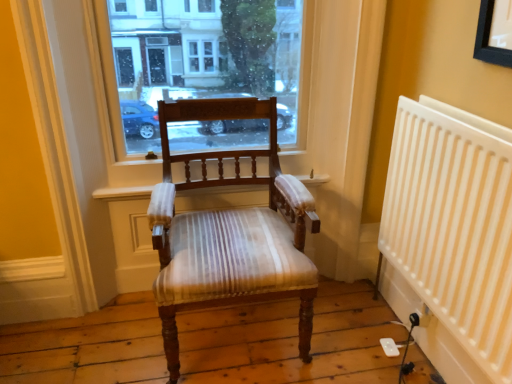
The height and width of the screenshot is (384, 512). What do you see at coordinates (230, 231) in the screenshot?
I see `wooden chair with striped upholstery at center` at bounding box center [230, 231].

Find the location of a particular element. This screenshot has height=384, width=512. transparent glass window at center is located at coordinates (201, 60).

Locate an element on the screen. The height and width of the screenshot is (384, 512). wooden chair with striped upholstery at center is located at coordinates (230, 231).

Can you confirm if wooden chair with striped upholstery at center is smaller than transparent glass window at center?

Incorrect, wooden chair with striped upholstery at center is not smaller in size than transparent glass window at center.

From a real-world perspective, is wooden chair with striped upholstery at center located higher than transparent glass window at center?

Incorrect, from a real-world perspective, wooden chair with striped upholstery at center is lower than transparent glass window at center.

Does wooden chair with striped upholstery at center turn towards transparent glass window at center?

No, wooden chair with striped upholstery at center is not facing towards transparent glass window at center.

Between wooden chair with striped upholstery at center and transparent glass window at center, which one has more height?

wooden chair with striped upholstery at center is taller.

Is wooden chair with striped upholstery at center far away from white plastic radiator at right?

No, wooden chair with striped upholstery at center is not far away from white plastic radiator at right.

Is wooden chair with striped upholstery at center facing away from white plastic radiator at right?

No, wooden chair with striped upholstery at center's orientation is not away from white plastic radiator at right.

Which is less distant, (x=172, y=226) or (x=463, y=236)?

Point (x=172, y=226) is positioned farther from the camera compared to point (x=463, y=236).

From a real-world perspective, is white plastic radiator at right located beneath transparent glass window at center?

Correct, in the physical world, white plastic radiator at right is lower than transparent glass window at center.

From the image's perspective, is white plastic radiator at right over transparent glass window at center?

No.

Is point (425, 245) positioned before point (170, 140)?

That is True.

Does point (386, 244) lie behind point (290, 190)?

Yes, point (386, 244) is farther from viewer.

Is white plastic radiator at right to the left or to the right of wooden chair with striped upholstery at center in the image?

white plastic radiator at right is positioned on wooden chair with striped upholstery at center's right side.

From a real-world perspective, which is physically above, white plastic radiator at right or wooden chair with striped upholstery at center?

white plastic radiator at right, from a real-world perspective.

How far apart are white plastic radiator at right and wooden chair with striped upholstery at center?

They are 58.35 centimeters apart.

From a real-world perspective, is transparent glass window at center located higher than wooden chair with striped upholstery at center?

Yes, from a real-world perspective, transparent glass window at center is on top of wooden chair with striped upholstery at center.

Relative to wooden chair with striped upholstery at center, is transparent glass window at center in front or behind?

Clearly, transparent glass window at center is behind wooden chair with striped upholstery at center.

Which point is more distant from viewer, (220,29) or (254,214)?

Positioned behind is point (220,29).

Could you tell me if transparent glass window at center is facing wooden chair with striped upholstery at center?

Yes, transparent glass window at center is facing wooden chair with striped upholstery at center.

Considering the sizes of objects transparent glass window at center and white plastic radiator at right in the image provided, who is taller, transparent glass window at center or white plastic radiator at right?

With more height is white plastic radiator at right.

From a real-world perspective, is transparent glass window at center positioned over white plastic radiator at right based on gravity?

Indeed, from a real-world perspective, transparent glass window at center stands above white plastic radiator at right.

Image resolution: width=512 pixels, height=384 pixels. Find the location of `radiator that appears on the right of transparent glass window at center`. radiator that appears on the right of transparent glass window at center is located at coordinates (454, 224).

Is transparent glass window at center aimed at white plastic radiator at right?

Yes.

What are the coordinates of `chair that appears below the transparent glass window at center (from the image's perspective)` in the screenshot? It's located at (230, 231).

Identify the location of chair directly beneath the white plastic radiator at right (from a real-world perspective). This screenshot has height=384, width=512. (230, 231).

Based on their spatial positions, is wooden chair with striped upholstery at center or transparent glass window at center closer to white plastic radiator at right?

wooden chair with striped upholstery at center lies closer to white plastic radiator at right than the other object.

Which object lies nearer to the anchor point wooden chair with striped upholstery at center, white plastic radiator at right or transparent glass window at center?

Based on the image, transparent glass window at center appears to be nearer to wooden chair with striped upholstery at center.

Which object lies further to the anchor point transparent glass window at center, white plastic radiator at right or wooden chair with striped upholstery at center?

white plastic radiator at right.

Considering their positions, is wooden chair with striped upholstery at center positioned further to transparent glass window at center than white plastic radiator at right?

white plastic radiator at right.

When comparing their distances from white plastic radiator at right, does transparent glass window at center or wooden chair with striped upholstery at center seem further?

transparent glass window at center is further to white plastic radiator at right.

Looking at the image, which one is located further to wooden chair with striped upholstery at center, transparent glass window at center or white plastic radiator at right?

white plastic radiator at right.

Where is `chair between transparent glass window at center and white plastic radiator at right in the horizontal direction`? The width and height of the screenshot is (512, 384). chair between transparent glass window at center and white plastic radiator at right in the horizontal direction is located at coordinates (230, 231).